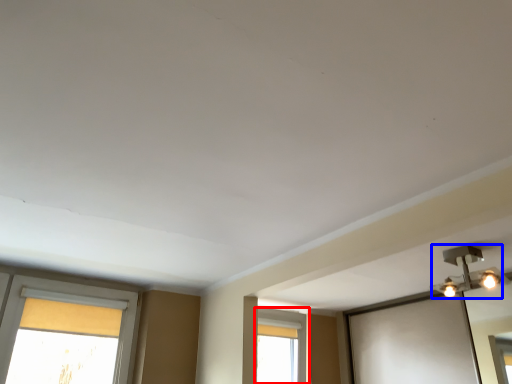
Question: Among these objects, which one is nearest to the camera, window (highlighted by a red box) or light fixture (highlighted by a blue box)?

Choices:
 (A) window
 (B) light fixture

Answer: (B)